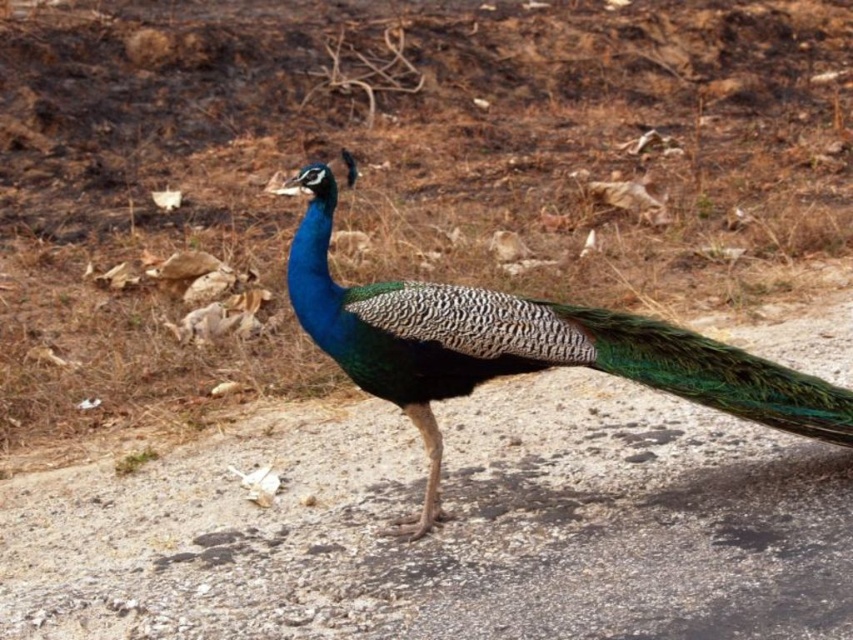
Question: Which of the following is the farthest from the observer?

Choices:
 (A) (347, 352)
 (B) (602, 323)

Answer: (B)

Question: Is shiny blue peacock at center further to the viewer compared to green iridescent feathers at center?

Choices:
 (A) no
 (B) yes

Answer: (A)

Question: Is shiny blue peacock at center further to camera compared to green iridescent feathers at center?

Choices:
 (A) no
 (B) yes

Answer: (A)

Question: Does shiny blue peacock at center appear on the right side of green iridescent feathers at center?

Choices:
 (A) yes
 (B) no

Answer: (B)